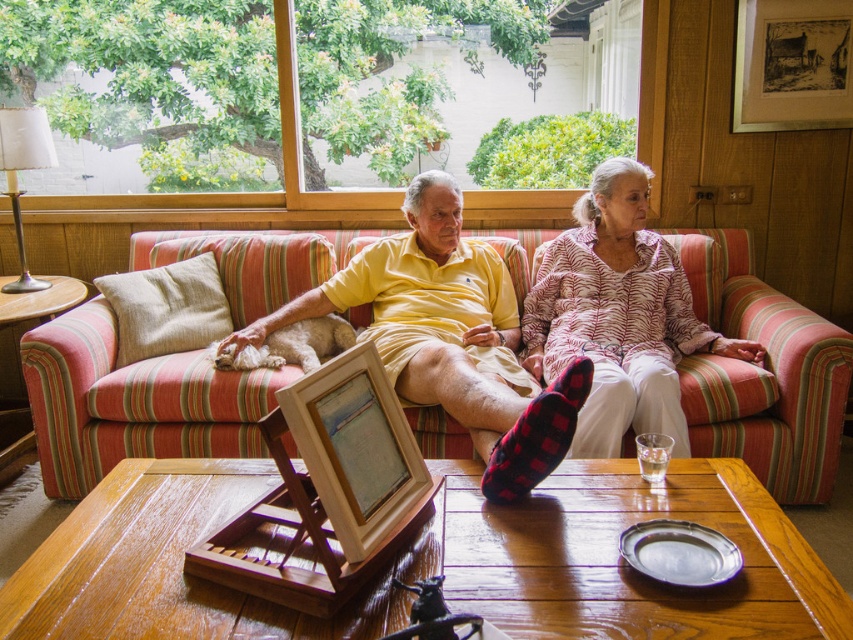
You are planning to place a rectangular tray that is 1.2 meters long on the wooden table at center. Considering the yellow cotton shirt at center is already on the table, will the tray fit horizontally on the table?

The wooden table at center is wider than the yellow cotton shirt at center. Since the shirt is on the table, the table must be at least as wide as the shirt. However, the tray is 1.2 meters long. Without knowing the exact width of the table, we cannot confirm if the tray will fit. The description only states the table is wider than the shirt, but not by how much. Please measure the table width before placing the tray.

You are standing in the room and see the image. There is a point at coordinates (450,337). What object is located at that point?

The point at coordinates (450,337) marks the yellow cotton shirt at center.

You are a guest in this living room and want to place your small handbag on the wooden table at center. However, you notice the red plaid sock at center is already occupying space on the table. Can you still place your handbag there?

The wooden table at center is bigger than the red plaid sock at center, so there should be enough space to place your handbag alongside the red plaid sock at center.